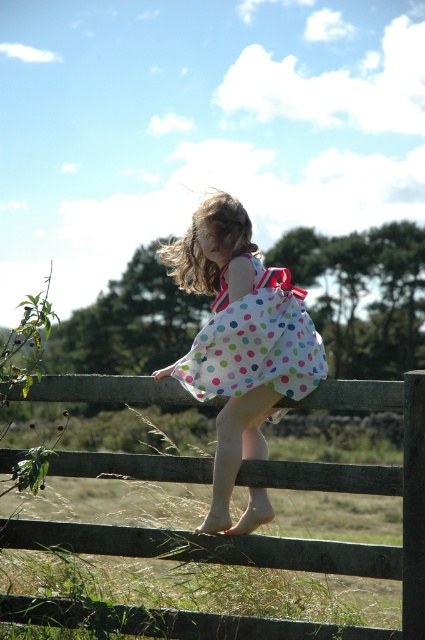
Between white polka dot dress at center and polka dot fabric dress at center, which one is positioned lower?

white polka dot dress at center

Which is in front, point (170, 248) or point (200, 340)?

Point (200, 340)

Identify the location of white polka dot dress at center. (240, 346).

Does wooden fence at center have a smaller size compared to polka dot fabric dress at center?

Incorrect, wooden fence at center is not smaller in size than polka dot fabric dress at center.

Between wooden fence at center and polka dot fabric dress at center, which one appears on the left side from the viewer's perspective?

Positioned to the left is wooden fence at center.

Between point (280, 474) and point (200, 353), which one is positioned in front?

Positioned in front is point (200, 353).

The image size is (425, 640). Find the location of `wooden fence at center`. wooden fence at center is located at coordinates (291, 488).

Does wooden fence at center lie behind white polka dot dress at center?

That is False.

Based on the photo, is wooden fence at center to the right of white polka dot dress at center from the viewer's perspective?

Incorrect, wooden fence at center is not on the right side of white polka dot dress at center.

Find the location of a particular element. This screenshot has width=425, height=640. wooden fence at center is located at coordinates (291, 488).